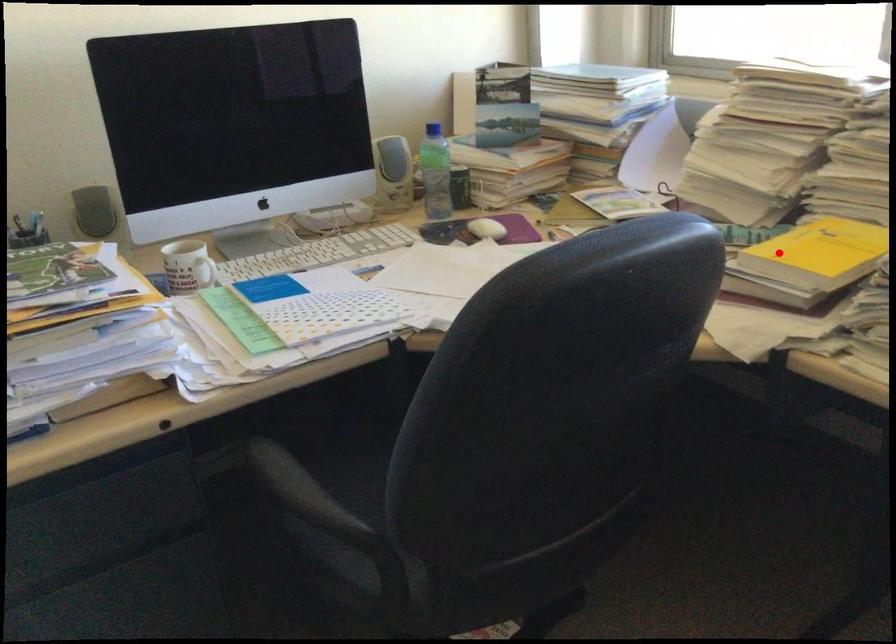
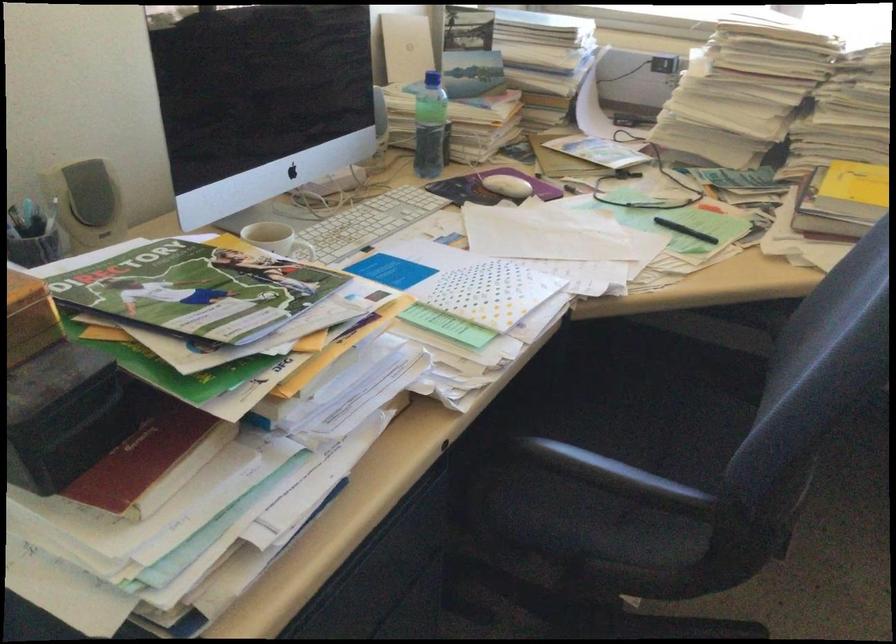
Where in the second image is the point corresponding to the highlighted location from the first image?

(853, 194)